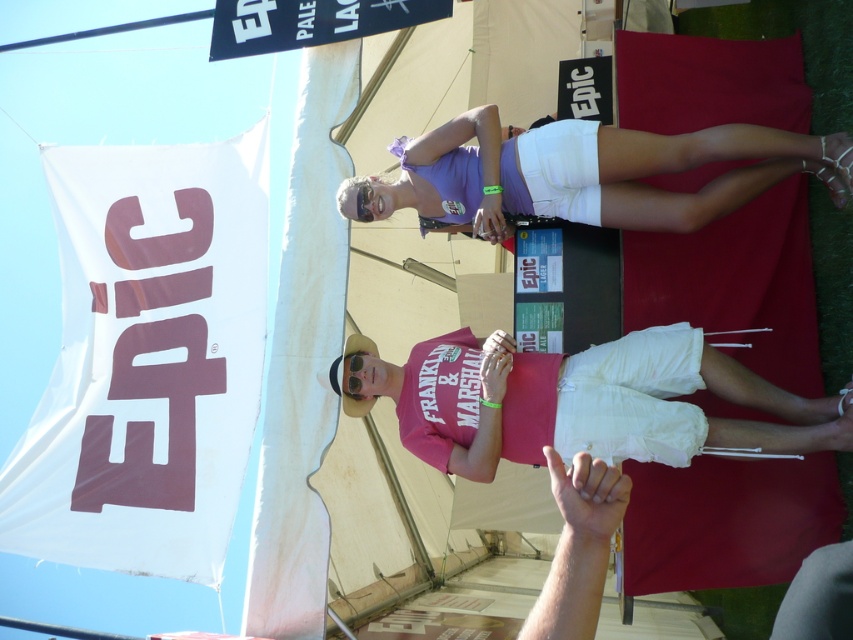
Does point (712, 392) come behind point (770, 147)?

Yes, point (712, 392) is farther from viewer.

Is pink cotton shirt at center shorter than purple fabric shorts at upper center?

No.

Consider the image. Who is more forward, (720,444) or (668,170)?

Point (720,444) is in front.

Where is `pink cotton shirt at center`? Image resolution: width=853 pixels, height=640 pixels. pink cotton shirt at center is located at coordinates (461, 400).